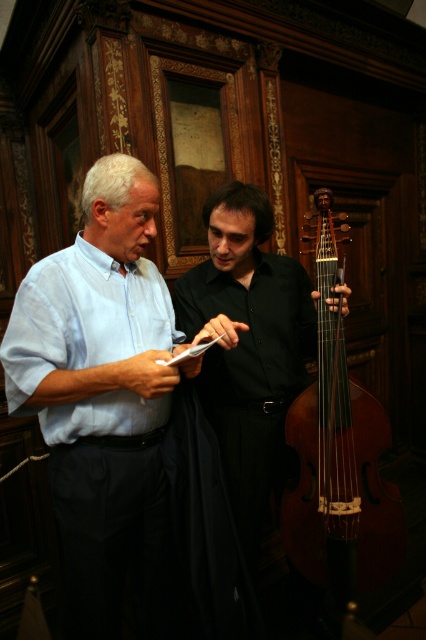
Question: Is light blue cotton shirt at center smaller than black smooth shirt at center?

Choices:
 (A) no
 (B) yes

Answer: (B)

Question: Which of the following is the closest to the observer?

Choices:
 (A) 112,172
 (B) 336,317

Answer: (A)

Question: Can you confirm if light blue cotton shirt at center is positioned above black smooth shirt at center?

Choices:
 (A) yes
 (B) no

Answer: (B)

Question: Which object is positioned closest to the brown wooden cello at center?

Choices:
 (A) light blue cotton shirt at center
 (B) black smooth shirt at center

Answer: (B)

Question: In this image, where is black smooth shirt at center located relative to brown wooden cello at center?

Choices:
 (A) above
 (B) below

Answer: (A)

Question: Which object is the closest to the brown wooden cello at center?

Choices:
 (A) light blue cotton shirt at center
 (B) black smooth shirt at center

Answer: (B)